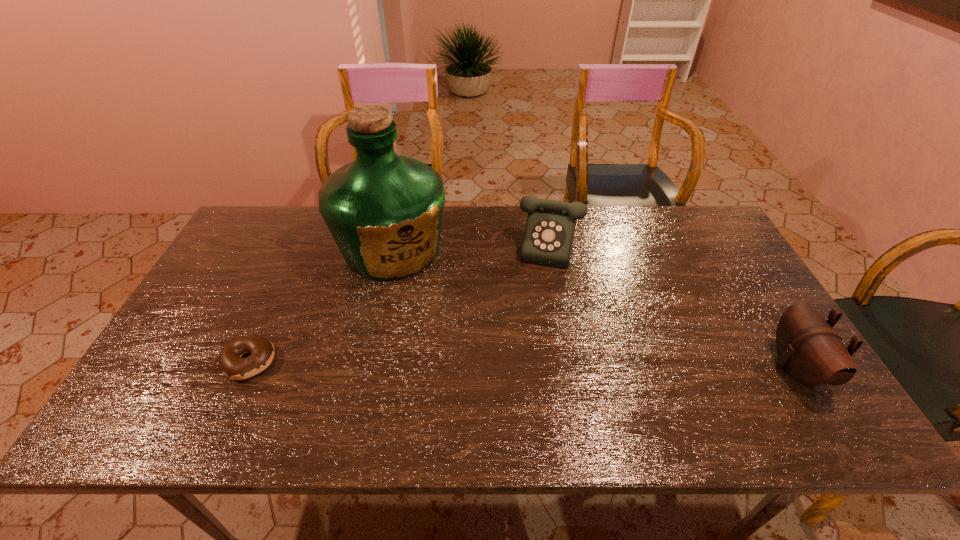
Find the location of a particular element. Image resolution: width=960 pixels, height=540 pixels. vacant space located 0.210m on the label side of the tallest object is located at coordinates tap(433, 338).

Locate an element on the screen. Image resolution: width=960 pixels, height=540 pixels. blank space located on the label side of the tallest object is located at coordinates (452, 381).

Where is `vacant space located on the label side of the tallest object`? The image size is (960, 540). vacant space located on the label side of the tallest object is located at coordinates pos(433,338).

Find the location of a particular element. This screenshot has height=540, width=960. vacant area situated 0.180m on the dial of the telephone is located at coordinates (552, 312).

Locate an element on the screen. This screenshot has height=540, width=960. free space located 0.090m on the dial of the telephone is located at coordinates (556, 289).

Locate an element on the screen. blank space located 0.180m on the dial of the telephone is located at coordinates (552, 312).

Identify the location of liquor at the far edge. The width and height of the screenshot is (960, 540). (384, 211).

This screenshot has height=540, width=960. Find the location of `telephone that is at the far edge`. telephone that is at the far edge is located at coordinates (548, 237).

Image resolution: width=960 pixels, height=540 pixels. Identify the location of doughnut that is at the near edge. (231, 363).

This screenshot has width=960, height=540. I want to click on pouch that is at the near edge, so pyautogui.click(x=811, y=352).